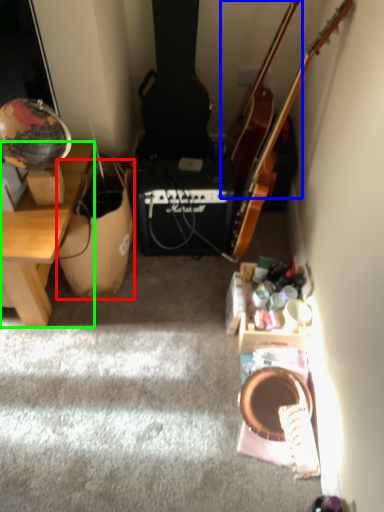
Question: Which object is positioned closest to cardboard box (highlighted by a red box)? Select from cello (highlighted by a blue box) and desk (highlighted by a green box).

Choices:
 (A) cello
 (B) desk

Answer: (B)